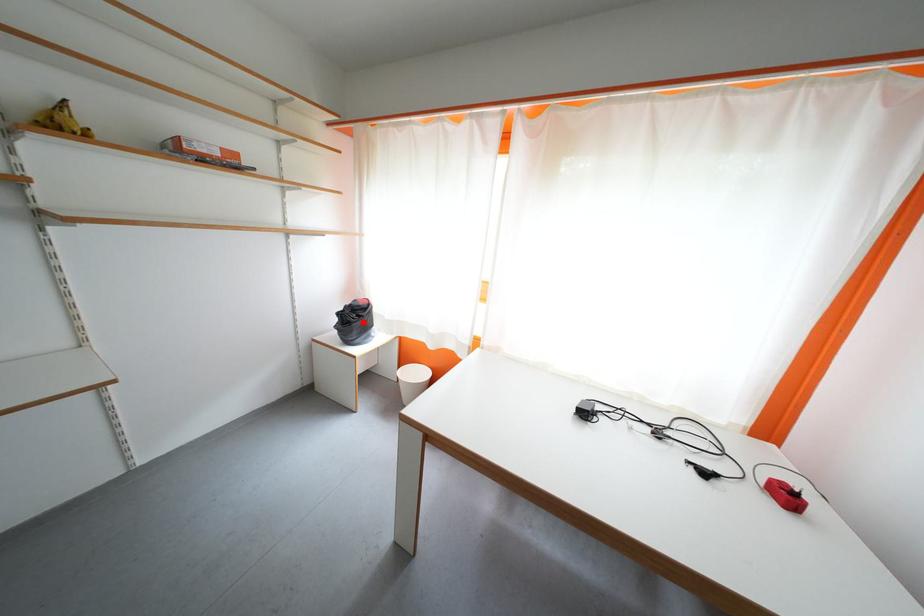
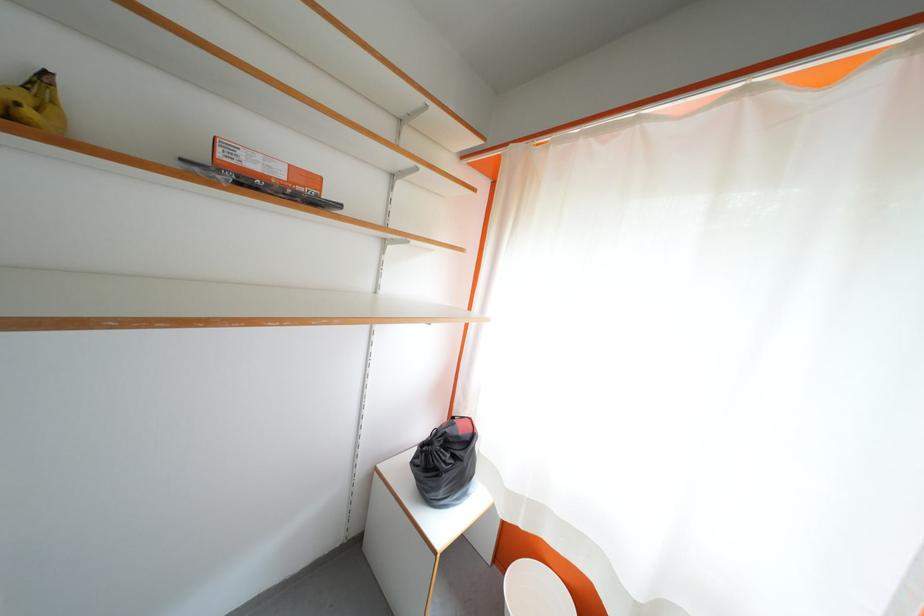
The point at the highlighted location is marked in the first image. Where is the corresponding point in the second image?

(455, 460)